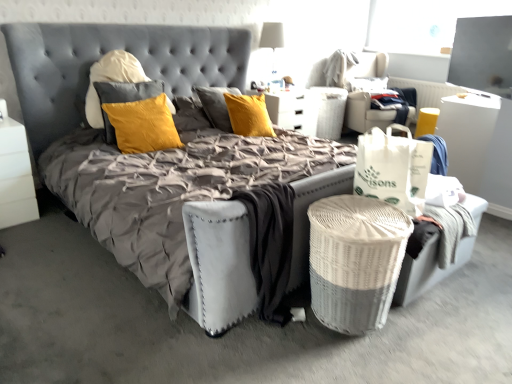
Question: Would you say white fabric swivel chair at upper right, which appears as the 2th swivel chair when viewed from the right, is to the left or to the right of white paper bag at right in the picture?

Choices:
 (A) right
 (B) left

Answer: (A)

Question: From the image's perspective, is white fabric swivel chair at upper right, marked as the 1th swivel chair in a left-to-right arrangement, located above or below white paper bag at right?

Choices:
 (A) below
 (B) above

Answer: (B)

Question: Which is nearer to the transparent glass window screen at upper right?

Choices:
 (A) yellow fabric swivel chair at upper right, the first swivel chair when ordered from right to left
 (B) white glossy nightstand at left
 (C) white fabric lampshade at upper center
 (D) yellow velvet pillow at center
 (E) white fabric swivel chair at upper right, marked as the 1th swivel chair in a left-to-right arrangement

Answer: (A)

Question: Based on their relative distances, which object is farther from the white fabric lampshade at upper center?

Choices:
 (A) white paper bag at right
 (B) white wicker laundry basket at lower right
 (C) transparent glass window screen at upper right
 (D) yellow fabric swivel chair at upper right, the 2th swivel chair viewed from the left
 (E) white glossy nightstand at left

Answer: (B)